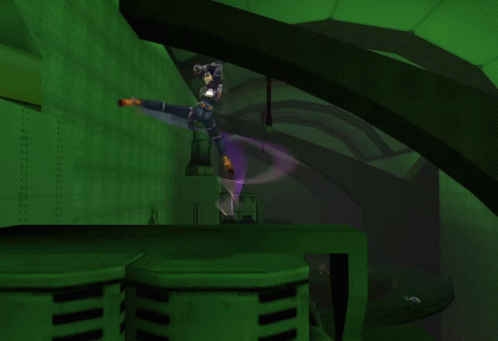
You are a GUI agent. You are given a task and a screenshot of the screen. Output one action in this format:
    pyautogui.click(x=<x>, y=<y>)
    Task: Click on the storage
    The image size is (498, 341).
    Given the screenshot: What is the action you would take?
    pyautogui.click(x=248, y=204), pyautogui.click(x=231, y=205)